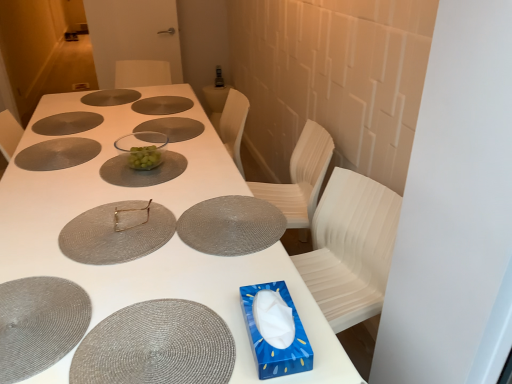
This screenshot has height=384, width=512. What are the coordinates of `empty space that is in between matte gray placemat at center, placed as the third glass plate when sorted from front to back, and transparent glass bowl at center` in the screenshot? It's located at (179, 179).